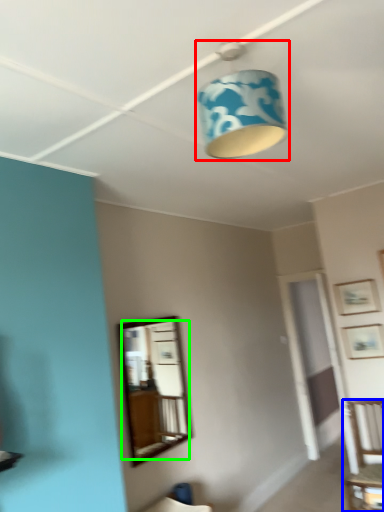
Question: Considering the real-world distances, which object is closest to lamp (highlighted by a red box)? furniture (highlighted by a blue box) or mirror (highlighted by a green box).

Choices:
 (A) furniture
 (B) mirror

Answer: (A)